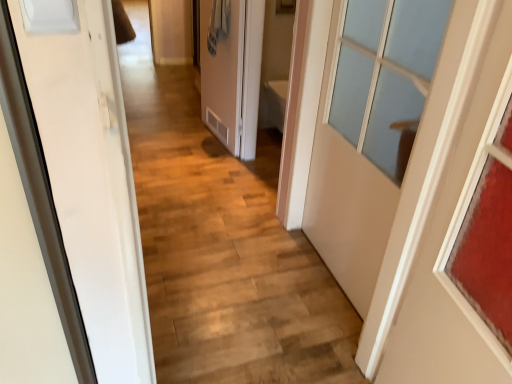
Locate an element on the screen. matte glass door at right, which appears as the 1th door when viewed from the front is located at coordinates (440, 219).

Identify the location of matte white door at center, the third door from the right. The height and width of the screenshot is (384, 512). (222, 69).

From a real-world perspective, which is physically below, matte white door at center, placed as the third door when sorted from front to back, or white matte door at right, the second door from the left?

From a 3D spatial view, matte white door at center, placed as the third door when sorted from front to back, is below.

Image resolution: width=512 pixels, height=384 pixels. Identify the location of door that is the 1st one when counting downward from the matte white door at center, the third door from the right (from the image's perspective). 372,131.

Does matte white door at center, the third door from the right, have a greater width compared to white matte door at right, which ranks as the second door in right-to-left order?

Incorrect, the width of matte white door at center, the third door from the right, does not surpass that of white matte door at right, which ranks as the second door in right-to-left order.

Is white matte door at right, the second door from the left, surrounded by matte white door at center, which appears as the 1th door when viewed from the left?

No.

Is white matte door at right, which is the second door in front-to-back order, positioned with its back to matte glass door at right, which appears as the 1th door when viewed from the front?

No.

Considering the relative sizes of white matte door at right, which ranks as the second door in right-to-left order, and matte glass door at right, which is counted as the 3th door, starting from the back, in the image provided, is white matte door at right, which ranks as the second door in right-to-left order, thinner than matte glass door at right, which is counted as the 3th door, starting from the back,?

No, white matte door at right, which ranks as the second door in right-to-left order, is not thinner than matte glass door at right, which is counted as the 3th door, starting from the back.

Where is `door on the right of white matte door at right, positioned as the second door in back-to-front order`? This screenshot has height=384, width=512. door on the right of white matte door at right, positioned as the second door in back-to-front order is located at coordinates (440, 219).

Is the position of matte glass door at right, the 1th door positioned from the right, less distant than that of white matte door at right, which ranks as the second door in right-to-left order?

That is True.

Could you tell me if matte glass door at right, which appears as the 1th door when viewed from the front, is facing white matte door at right, which ranks as the second door in right-to-left order?

No, matte glass door at right, which appears as the 1th door when viewed from the front, is not aimed at white matte door at right, which ranks as the second door in right-to-left order.

How many degrees apart are the facing directions of matte glass door at right, which appears as the 1th door when viewed from the front, and white matte door at right, which is the second door in front-to-back order?

The angle between the facing direction of matte glass door at right, which appears as the 1th door when viewed from the front, and the facing direction of white matte door at right, which is the second door in front-to-back order, is 10.3 degrees.

Is matte glass door at right, which appears as the 1th door when viewed from the front, outside of white matte door at right, which is the second door in front-to-back order?

Yes, matte glass door at right, which appears as the 1th door when viewed from the front, is located beyond the bounds of white matte door at right, which is the second door in front-to-back order.

From a real-world perspective, is matte white door at center, placed as the third door when sorted from front to back, positioned above or below matte glass door at right, the 1th door positioned from the right?

From a real-world perspective, matte white door at center, placed as the third door when sorted from front to back, is physically below matte glass door at right, the 1th door positioned from the right.

Is matte white door at center, which appears as the 1th door when viewed from the left, with matte glass door at right, which appears as the 1th door when viewed from the front?

matte white door at center, which appears as the 1th door when viewed from the left, and matte glass door at right, which appears as the 1th door when viewed from the front, are not in contact.

Which is more to the left, matte white door at center, placed as the third door when sorted from front to back, or matte glass door at right, which is the third door in left-to-right order?

Positioned to the left is matte white door at center, placed as the third door when sorted from front to back.

Does matte white door at center, which appears as the 1th door when viewed from the left, have a greater width compared to matte glass door at right, the 1th door positioned from the right?

In fact, matte white door at center, which appears as the 1th door when viewed from the left, might be narrower than matte glass door at right, the 1th door positioned from the right.

Is matte glass door at right, which is the third door in left-to-right order, bigger than matte white door at center, which appears as the 1th door when viewed from the left?

Indeed, matte glass door at right, which is the third door in left-to-right order, has a larger size compared to matte white door at center, which appears as the 1th door when viewed from the left.

Is matte glass door at right, which appears as the 1th door when viewed from the front, next to matte white door at center, the third door from the right, and touching it?

They are not placed beside each other.

Which point is more forward, (490, 20) or (226, 108)?

The point (490, 20) is closer.

Is matte white door at center, the third door from the right, at the back of matte glass door at right, which appears as the 1th door when viewed from the front?

No, matte glass door at right, which appears as the 1th door when viewed from the front, is not facing away from matte white door at center, the third door from the right.

From the image's perspective, is white matte door at right, which ranks as the second door in right-to-left order, located beneath matte white door at center, the third door from the right?

Indeed, from the image's perspective, white matte door at right, which ranks as the second door in right-to-left order, is shown beneath matte white door at center, the third door from the right.

Consider the image. Does white matte door at right, which ranks as the second door in right-to-left order, turn towards matte white door at center, placed as the third door when sorted from front to back?

No, white matte door at right, which ranks as the second door in right-to-left order, does not turn towards matte white door at center, placed as the third door when sorted from front to back.

Considering the relative sizes of white matte door at right, which is the second door in front-to-back order, and matte white door at center, which is counted as the first door, starting from the back, in the image provided, is white matte door at right, which is the second door in front-to-back order, smaller than matte white door at center, which is counted as the first door, starting from the back,?

No.

Starting from the matte white door at center, placed as the third door when sorted from front to back, which door is the 1st one to the right? Please provide its 2D coordinates.

[(372, 131)]

From the image's perspective, count 1st doors upward from the matte glass door at right, which is the third door in left-to-right order, and point to it. Please provide its 2D coordinates.

[(372, 131)]

Based on their spatial positions, is white matte door at right, the second door from the left, or matte glass door at right, the 1th door positioned from the right, further from matte white door at center, the third door from the right?

The object further to matte white door at center, the third door from the right, is matte glass door at right, the 1th door positioned from the right.

Considering their positions, is matte glass door at right, which appears as the 1th door when viewed from the front, positioned further to white matte door at right, positioned as the second door in back-to-front order, than matte white door at center, placed as the third door when sorted from front to back?

Based on the image, matte white door at center, placed as the third door when sorted from front to back, appears to be further to white matte door at right, positioned as the second door in back-to-front order.

Which object lies further to the anchor point matte glass door at right, which is the third door in left-to-right order, white matte door at right, the second door from the left, or matte white door at center, placed as the third door when sorted from front to back?

matte white door at center, placed as the third door when sorted from front to back, is further to matte glass door at right, which is the third door in left-to-right order.

From the picture: Estimate the real-world distances between objects in this image. Which object is closer to matte white door at center, the third door from the right, matte glass door at right, which is counted as the 3th door, starting from the back, or white matte door at right, the second door from the left?

The object closer to matte white door at center, the third door from the right, is white matte door at right, the second door from the left.

Considering their positions, is matte white door at center, placed as the third door when sorted from front to back, positioned closer to matte glass door at right, which is counted as the 3th door, starting from the back, than white matte door at right, the second door from the left?

white matte door at right, the second door from the left, is closer to matte glass door at right, which is counted as the 3th door, starting from the back.

Consider the image. Which object lies further to the anchor point white matte door at right, which ranks as the second door in right-to-left order, matte white door at center, which appears as the 1th door when viewed from the left, or matte glass door at right, which appears as the 1th door when viewed from the front?

The object further to white matte door at right, which ranks as the second door in right-to-left order, is matte white door at center, which appears as the 1th door when viewed from the left.

Locate an element on the screen. door located between matte glass door at right, which is counted as the 3th door, starting from the back, and matte white door at center, placed as the third door when sorted from front to back, in the depth direction is located at coordinates (372, 131).